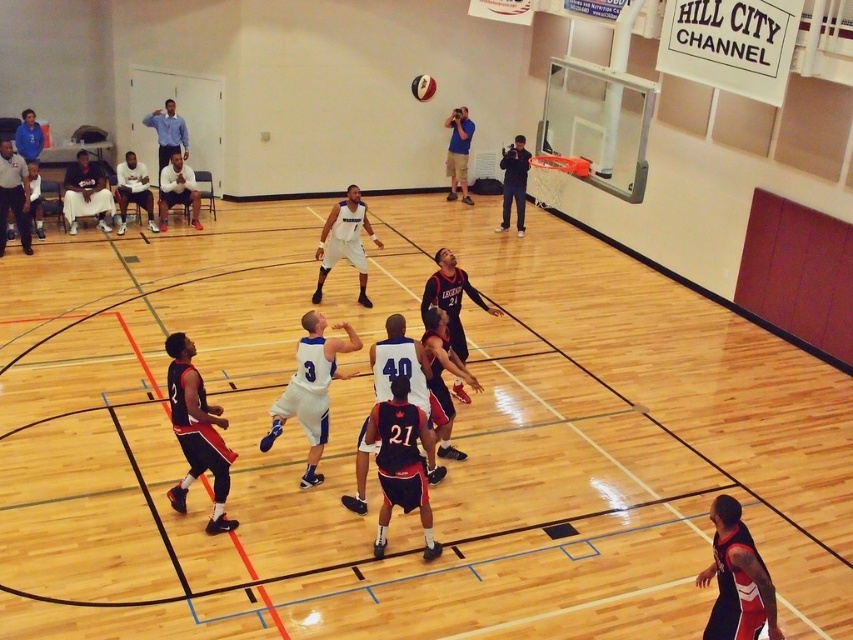
Does blue shirt at upper left appear under shiny orange basketball at center?

Indeed, blue shirt at upper left is positioned under shiny orange basketball at center.

This screenshot has width=853, height=640. I want to click on blue shirt at upper left, so click(167, 132).

Is point (154, 129) closer to viewer compared to point (433, 83)?

That is True.

Find the location of `blue shirt at upper left`. blue shirt at upper left is located at coordinates (167, 132).

Can you confirm if matte black basketball at upper left is shorter than dark blue jeans at upper right?

Correct, matte black basketball at upper left is not as tall as dark blue jeans at upper right.

The height and width of the screenshot is (640, 853). What are the coordinates of `matte black basketball at upper left` in the screenshot? It's located at (13, 195).

Identify the location of matte black basketball at upper left. [x=13, y=195].

Who is lower down, white shirt at center or blue shirt at upper left?

white shirt at center

Locate an element on the screen. white shirt at center is located at coordinates (177, 189).